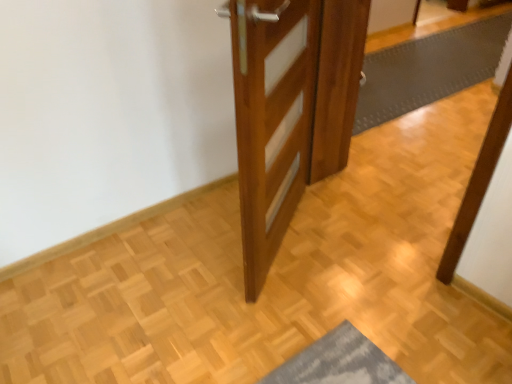
Question: From a real-world perspective, is wooden door at center beneath gray rubber bath mat at center?

Choices:
 (A) yes
 (B) no

Answer: (B)

Question: Is wooden door at center outside gray rubber bath mat at center?

Choices:
 (A) yes
 (B) no

Answer: (A)

Question: Does wooden door at center have a lesser height compared to gray rubber bath mat at center?

Choices:
 (A) yes
 (B) no

Answer: (B)

Question: From a real-world perspective, is wooden door at center over gray rubber bath mat at center?

Choices:
 (A) yes
 (B) no

Answer: (A)

Question: Could you tell me if wooden door at center is facing gray rubber bath mat at center?

Choices:
 (A) yes
 (B) no

Answer: (B)

Question: Is wooden door at center looking in the opposite direction of gray rubber bath mat at center?

Choices:
 (A) yes
 (B) no

Answer: (B)

Question: Considering the relative sizes of gray rubber bath mat at center and wooden door at center in the image provided, is gray rubber bath mat at center smaller than wooden door at center?

Choices:
 (A) yes
 (B) no

Answer: (B)

Question: Is gray rubber bath mat at center in front of wooden door at center?

Choices:
 (A) no
 (B) yes

Answer: (A)

Question: Does gray rubber bath mat at center turn towards wooden door at center?

Choices:
 (A) no
 (B) yes

Answer: (A)

Question: From the image's perspective, is gray rubber bath mat at center above wooden door at center?

Choices:
 (A) no
 (B) yes

Answer: (B)

Question: Is the surface of gray rubber bath mat at center in direct contact with wooden door at center?

Choices:
 (A) yes
 (B) no

Answer: (B)

Question: From a real-world perspective, is gray rubber bath mat at center physically below wooden door at center?

Choices:
 (A) no
 (B) yes

Answer: (B)

Question: From the image's perspective, is wooden door at center positioned above or below gray rubber bath mat at center?

Choices:
 (A) below
 (B) above

Answer: (A)